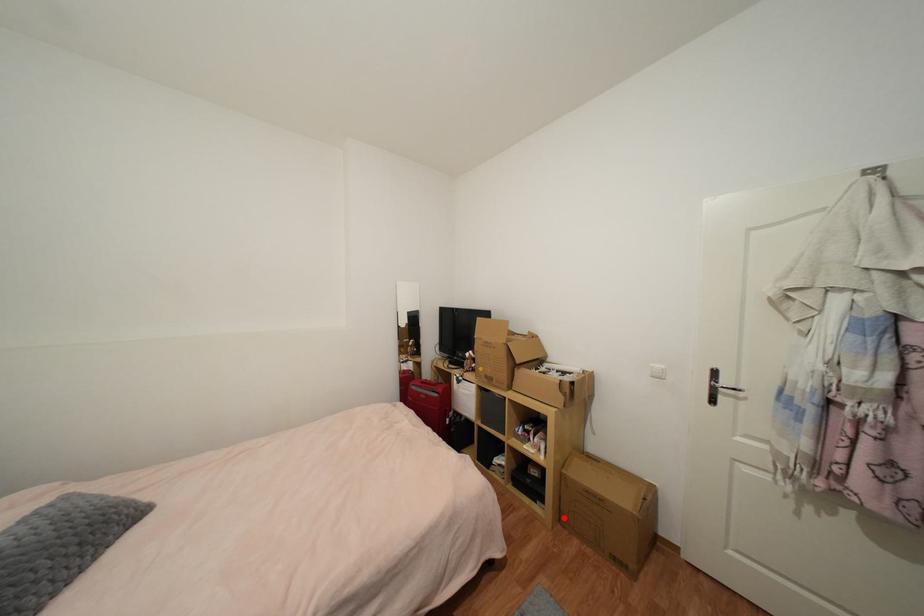
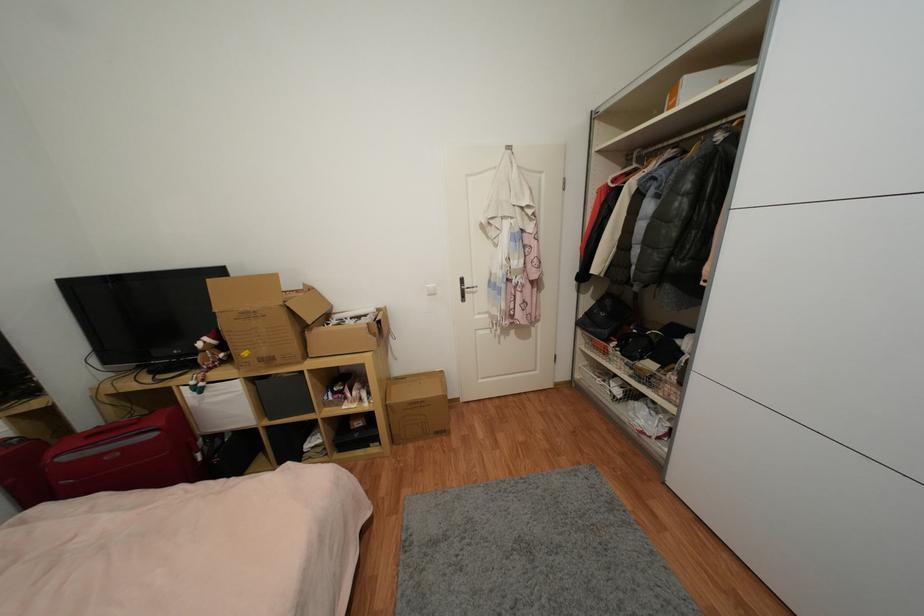
The point at the highlighted location is marked in the first image. Where is the corresponding point in the second image?

(397, 440)